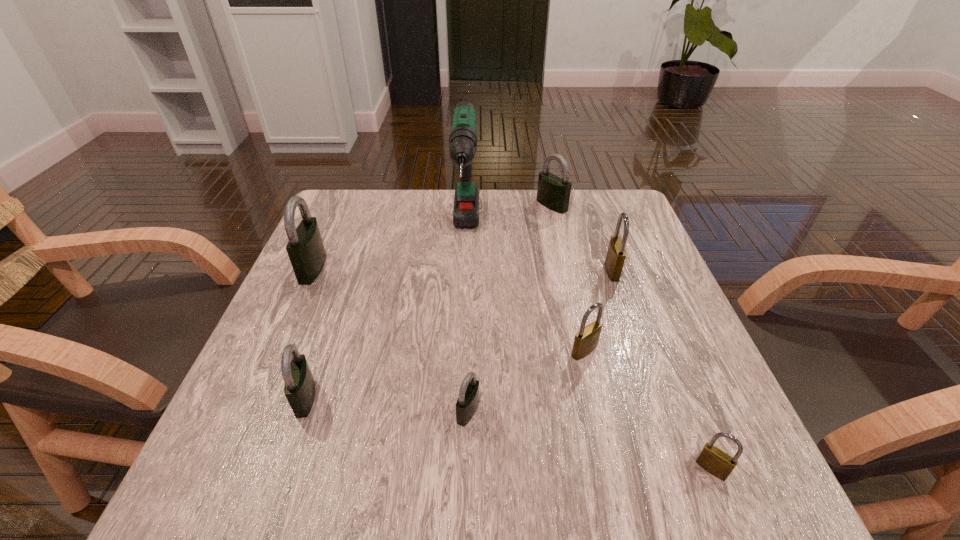
Where is `free space at the right edge`? Image resolution: width=960 pixels, height=540 pixels. free space at the right edge is located at coordinates (625, 321).

Image resolution: width=960 pixels, height=540 pixels. In the image, there is a desktop. Identify the location of vacant space at the far left corner. (340, 205).

What are the coordinates of `free region at the far right corner` in the screenshot? It's located at (640, 219).

Image resolution: width=960 pixels, height=540 pixels. Identify the location of free area in between the rightmost object and the farthest brass padlock. (661, 370).

Find the location of a particular element. free spot between the farthest padlock and the second object from right to left is located at coordinates (582, 238).

Locate an element on the screen. Image resolution: width=960 pixels, height=540 pixels. free spot between the sixth padlock from left to right and the seventh shortest object is located at coordinates (463, 269).

At what (x,y) coordinates should I click in order to perform the action: click on vacant space that is in between the second farthest brass padlock and the rightmost black padlock. Please return your answer as a coordinate pair (x, y). Image resolution: width=960 pixels, height=540 pixels. Looking at the image, I should click on (568, 278).

What are the coordinates of `free spot between the third nearest black padlock and the seventh object from right to left` in the screenshot? It's located at 309,333.

Where is `free spot between the tallest padlock and the biggest brass padlock`? The height and width of the screenshot is (540, 960). free spot between the tallest padlock and the biggest brass padlock is located at coordinates (463, 269).

At what (x,y) coordinates should I click in order to perform the action: click on free area in between the biggest brass padlock and the leftmost padlock. Please return your answer as a coordinate pair (x, y). This screenshot has width=960, height=540. Looking at the image, I should click on (463, 269).